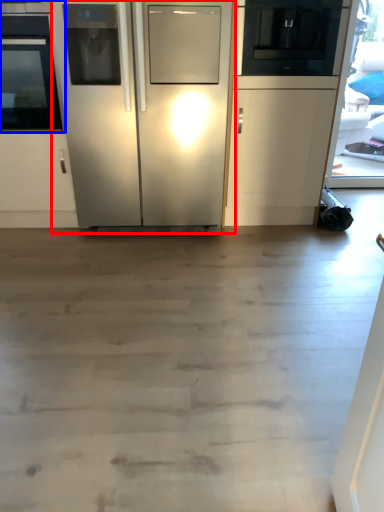
Question: Among these objects, which one is nearest to the camera, refrigerator (highlighted by a red box) or oven (highlighted by a blue box)?

Choices:
 (A) refrigerator
 (B) oven

Answer: (A)